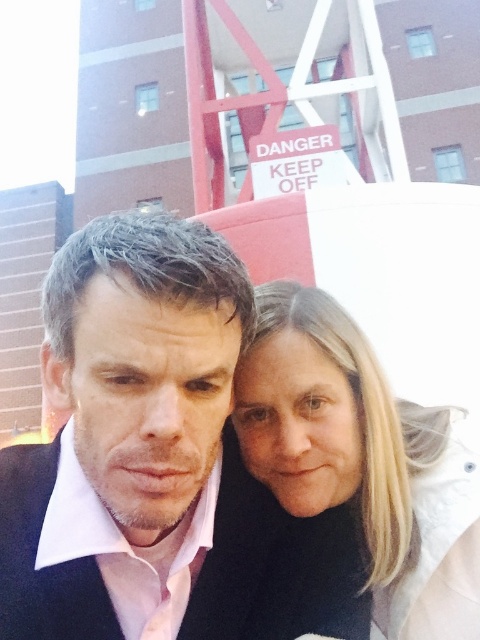
Question: Which point is closer to the camera taking this photo?

Choices:
 (A) (265, 301)
 (B) (179, 481)

Answer: (B)

Question: Which point is farther to the camera?

Choices:
 (A) pyautogui.click(x=219, y=417)
 (B) pyautogui.click(x=405, y=614)

Answer: (A)

Question: Is black matte jacket at center below blonde hair at center?

Choices:
 (A) yes
 (B) no

Answer: (A)

Question: Is the position of black matte jacket at center less distant than that of blonde hair at center?

Choices:
 (A) no
 (B) yes

Answer: (B)

Question: Is black matte jacket at center to the right of blonde hair at center from the viewer's perspective?

Choices:
 (A) no
 (B) yes

Answer: (A)